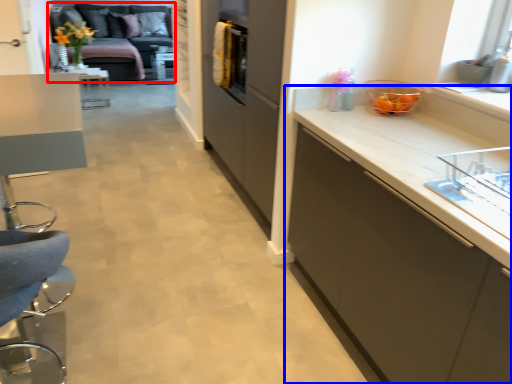
Question: Which object is closer to the camera taking this photo, studio couch (highlighted by a red box) or cabinetry (highlighted by a blue box)?

Choices:
 (A) studio couch
 (B) cabinetry

Answer: (B)